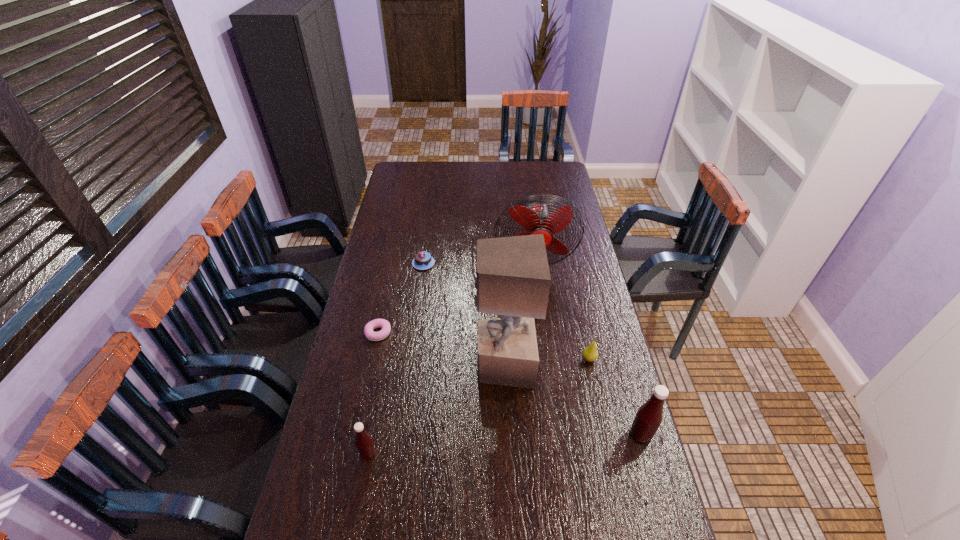
To achieve uniform spacing by inserting another Tabasco_sauce among them, please point to a free space for this new Tabasco_sauce. Please provide its 2D coordinates. Your answer should be formatted as a tuple, i.e. [(x, y)], where the tuple contains the x and y coordinates of a point satisfying the conditions above.

[(507, 444)]